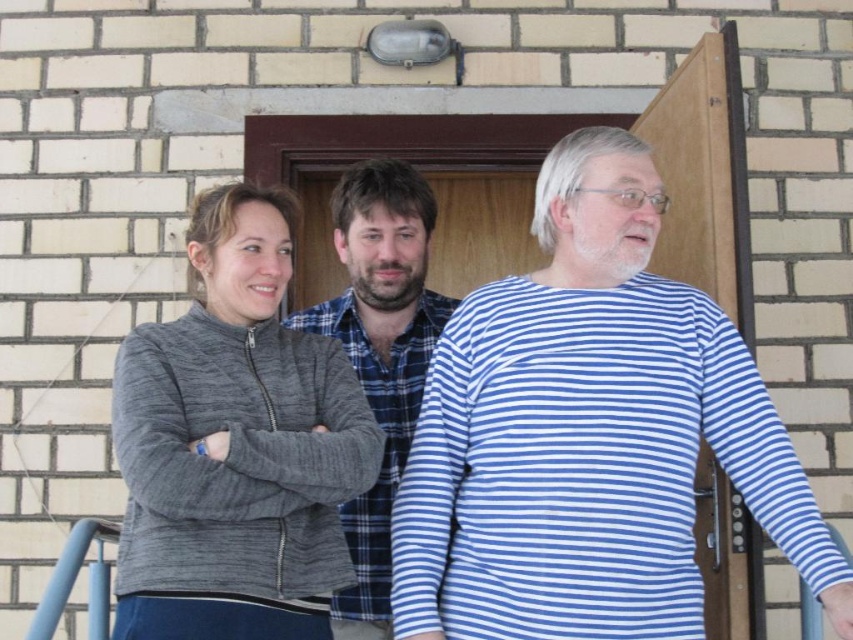
Question: Does gray textured sweater at center have a smaller size compared to blue plaid shirt at center?

Choices:
 (A) yes
 (B) no

Answer: (B)

Question: Where is blue striped shirt at center located in relation to gray textured sweater at center in the image?

Choices:
 (A) right
 (B) left

Answer: (A)

Question: Which object appears farthest from the camera in this image?

Choices:
 (A) blue plaid shirt at center
 (B) blue striped shirt at center

Answer: (A)

Question: Which point is farther to the camera?

Choices:
 (A) blue plaid shirt at center
 (B) blue striped shirt at center

Answer: (A)

Question: Considering the relative positions of gray textured sweater at center and blue plaid shirt at center in the image provided, where is gray textured sweater at center located with respect to blue plaid shirt at center?

Choices:
 (A) below
 (B) above

Answer: (B)

Question: Which of these objects is positioned closest to the blue plaid shirt at center?

Choices:
 (A) gray textured sweater at center
 (B) blue striped shirt at center

Answer: (B)